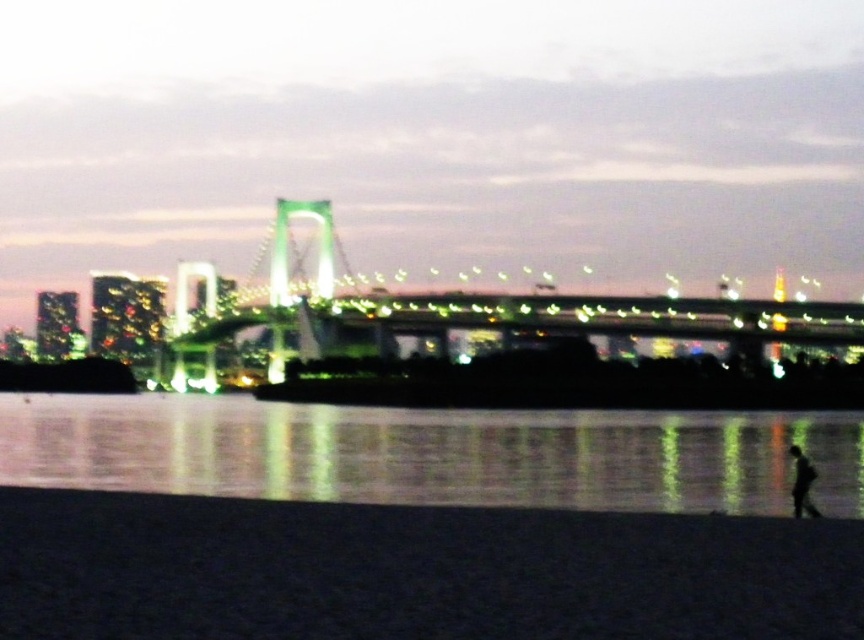
In the scene shown: You are a drone operator who needs to capture a closeup shot of the dark sand at lower center and the reflective glass water at lower center. Given that your drone can only hover 100 meters away from its current position, can you capture both scenes without moving the drone?

The dark sand at lower center is 96.37 meters from the reflective glass water at lower center. Since the drone can hover up to 100 meters away, it is possible to capture both scenes without moving the drone as the distance between them is within the drone